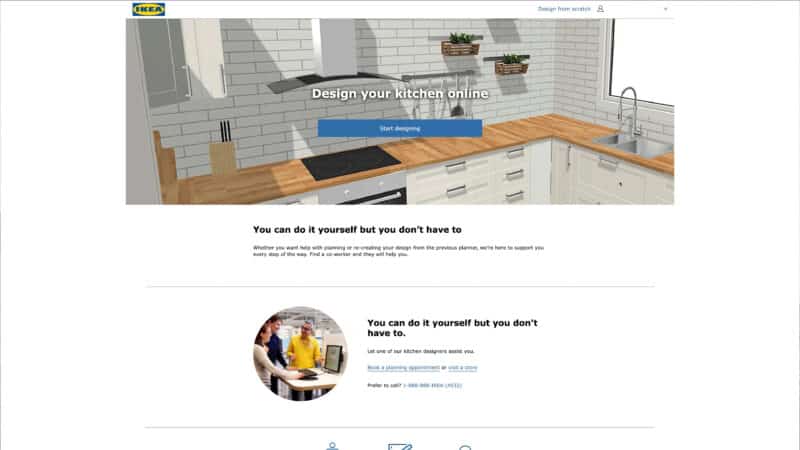
Locate an element on the screen. The image size is (800, 450). knife block is located at coordinates (220, 155).